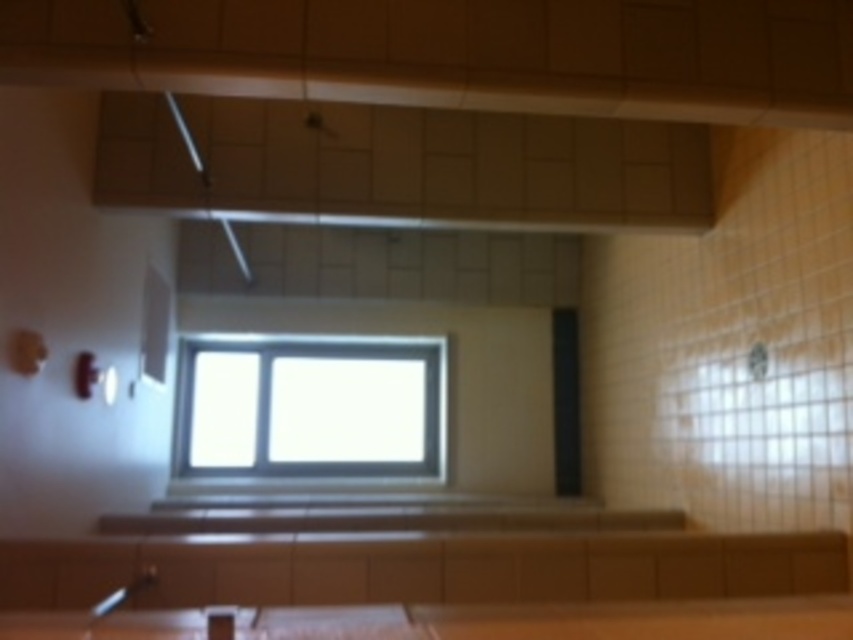
Question: From the image, what is the correct spatial relationship of clear glass window at center in relation to brown wood counter top at lower center?

Choices:
 (A) right
 (B) left

Answer: (B)

Question: Which point is farther to the camera?

Choices:
 (A) (405, 388)
 (B) (482, 630)

Answer: (A)

Question: Does clear glass window at center appear on the right side of brown wood counter top at lower center?

Choices:
 (A) no
 (B) yes

Answer: (A)

Question: Can you confirm if clear glass window at center is positioned to the left of brown wood counter top at lower center?

Choices:
 (A) no
 (B) yes

Answer: (B)